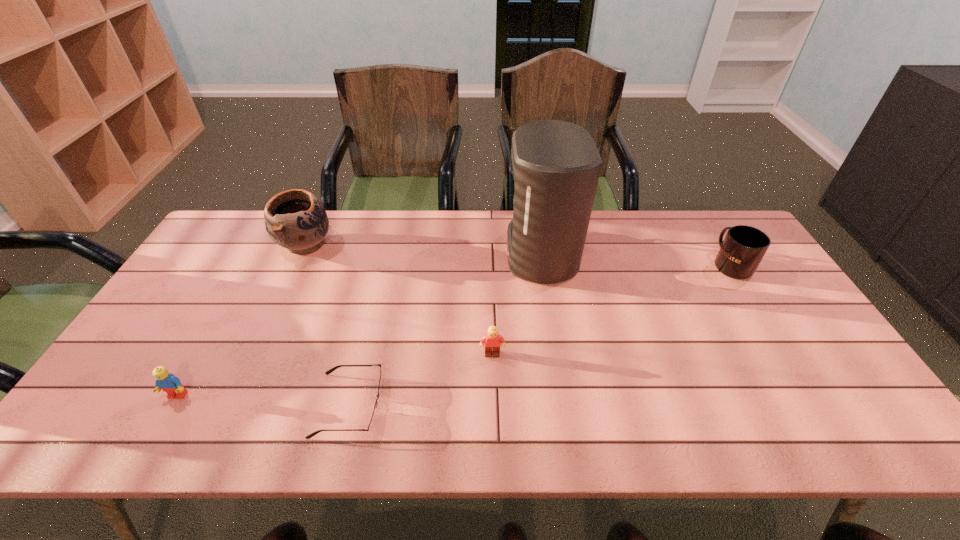
At what (x,y) coordinates should I click in order to perform the action: click on vacant point at the right edge. Please return your answer as a coordinate pair (x, y). This screenshot has width=960, height=540. Looking at the image, I should click on (769, 327).

Locate an element on the screen. vacant point at the far left corner is located at coordinates (252, 249).

At what (x,y) coordinates should I click in order to perform the action: click on free location at the near left corner of the desktop. Please return your answer as a coordinate pair (x, y). This screenshot has height=540, width=960. Looking at the image, I should click on (74, 441).

What are the coordinates of `unoccupied position between the third object from left to right and the fifth object from left to right` in the screenshot? It's located at (444, 329).

In order to click on vacant region between the second object from right to left and the third object from right to left in this screenshot , I will do `click(516, 304)`.

Identify the location of empty space that is in between the fourth shortest object and the nearer Lego. The height and width of the screenshot is (540, 960). click(454, 330).

Locate an element on the screen. This screenshot has height=540, width=960. free space between the tallest object and the nearer Lego is located at coordinates (359, 325).

Image resolution: width=960 pixels, height=540 pixels. I want to click on free spot between the shortest object and the fourth shortest object, so click(x=540, y=335).

Where is `vacant space that is in between the right Lego and the second tallest object`? vacant space that is in between the right Lego and the second tallest object is located at coordinates (398, 299).

You are a GUI agent. You are given a task and a screenshot of the screen. Output one action in this format:
    pyautogui.click(x=<x>, y=<y>)
    Task: Click on the vacant area that lies between the third nearest object and the spectacles
    
    Given the screenshot: What is the action you would take?
    pyautogui.click(x=420, y=380)